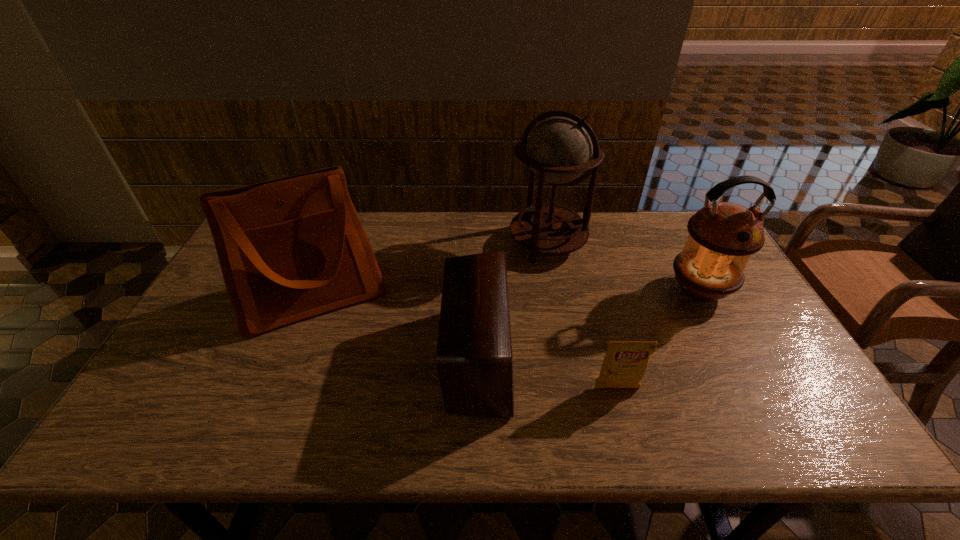
I want to click on the second closest object to the second object from left to right, so click(291, 248).